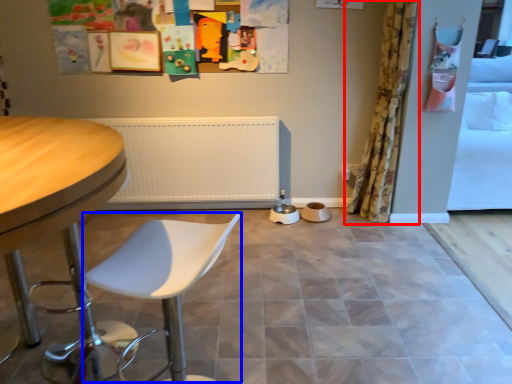
Question: Which object appears farthest to the camera in this image, curtain (highlighted by a red box) or swivel chair (highlighted by a blue box)?

Choices:
 (A) curtain
 (B) swivel chair

Answer: (A)